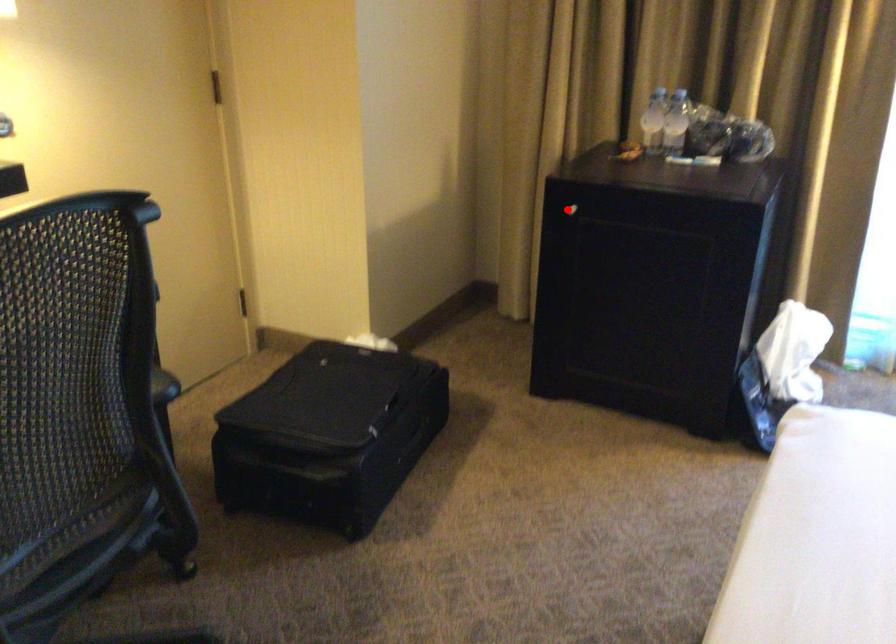
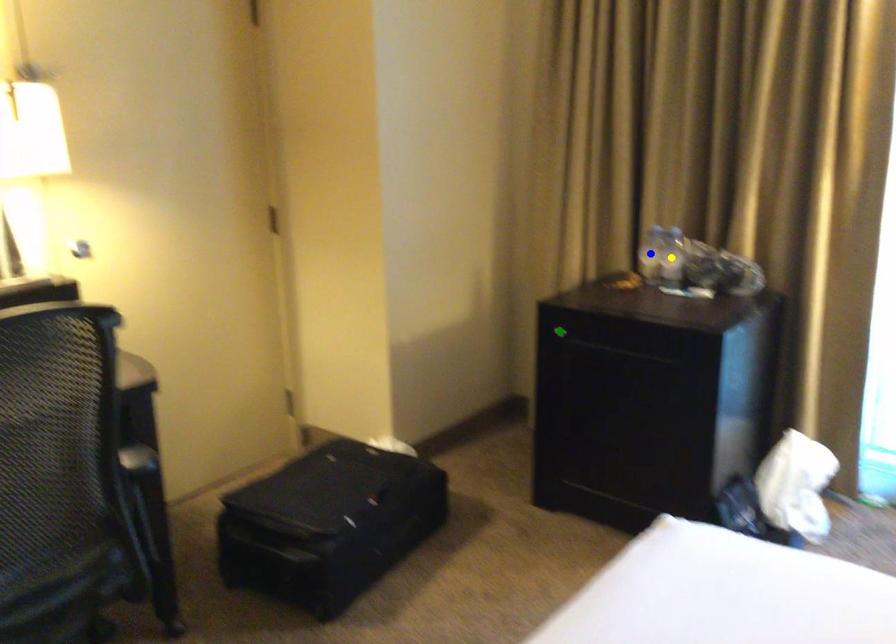
Question: I am providing you with two images of the same scene from different viewpoints. A red point is marked on the first image. You are given multiple points on the second image. In image 2, which mark is for the same physical point as the one in image 1?

Choices:
 (A) yellow point
 (B) green point
 (C) blue point

Answer: (B)